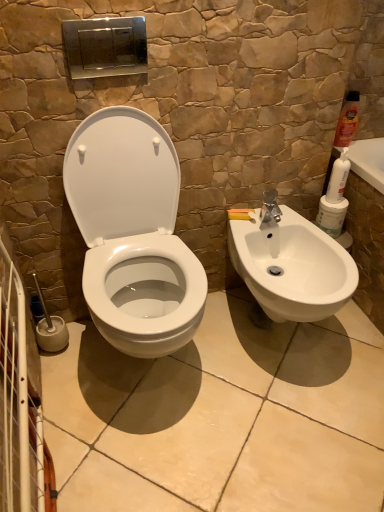
Question: Considering the positions of white glossy toilet at center and white matte cleaning product at right, positioned as the 2th cleaning product in top-to-bottom order, in the image, is white glossy toilet at center taller or shorter than white matte cleaning product at right, positioned as the 2th cleaning product in top-to-bottom order,?

Choices:
 (A) tall
 (B) short

Answer: (A)

Question: Is white glossy toilet at center to the left or to the right of white matte cleaning product at right, the 2th cleaning product viewed from the right, in the image?

Choices:
 (A) left
 (B) right

Answer: (A)

Question: Which object is positioned farthest from the matte orange bottle at upper right, the 1th cleaning product viewed from the right?

Choices:
 (A) white matte cleaning product at right, the 2th cleaning product viewed from the right
 (B) white glossy toilet at center

Answer: (B)

Question: Which object is positioned closest to the white glossy toilet at center?

Choices:
 (A) matte orange bottle at upper right, which is the first cleaning product from top to bottom
 (B) white matte cleaning product at right, the 2th cleaning product viewed from the right

Answer: (B)